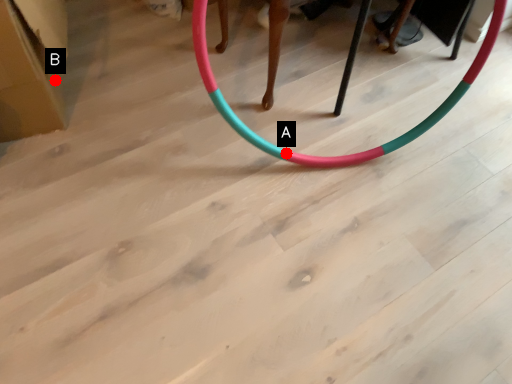
Question: Two points are circled on the image, labeled by A and B beside each circle. Which point is farther from the camera taking this photo?

Choices:
 (A) A is further
 (B) B is further

Answer: (A)